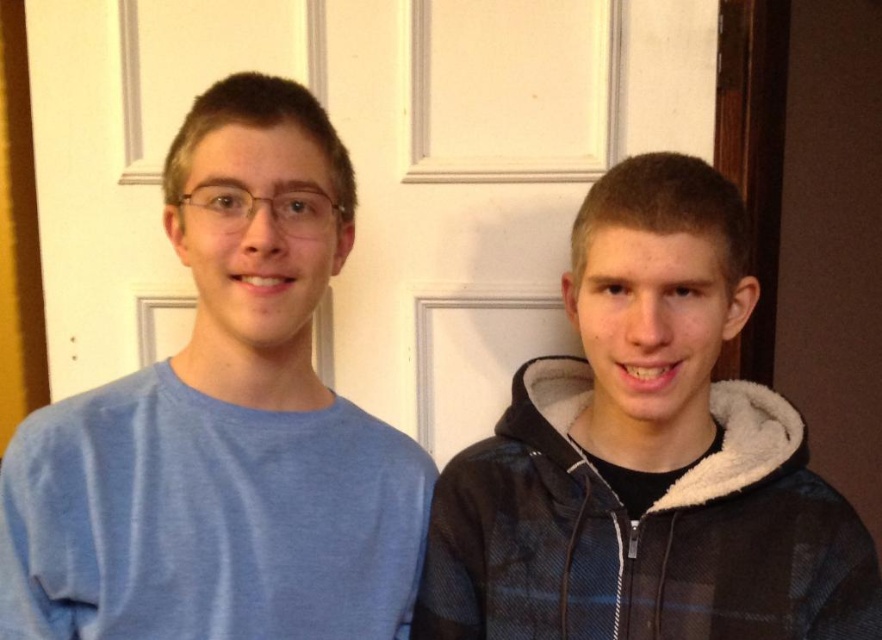
Between white matte door at center and matte blue shirt at left, which one has more height?

With more height is white matte door at center.

In the scene shown: Does white matte door at center have a larger size compared to matte blue shirt at left?

Correct, white matte door at center is larger in size than matte blue shirt at left.

Who is more forward, (x=419, y=284) or (x=262, y=92)?

Point (x=262, y=92)

The image size is (882, 640). Find the location of `white matte door at center`. white matte door at center is located at coordinates (363, 172).

Which is above, matte blue shirt at left or black fleece hoodie at center?

matte blue shirt at left is higher up.

Is point (280, 609) farther from viewer compared to point (771, 625)?

No, (280, 609) is in front of (771, 625).

The image size is (882, 640). I want to click on matte blue shirt at left, so click(x=223, y=426).

Can you confirm if white matte door at center is bigger than black fleece hoodie at center?

Indeed, white matte door at center has a larger size compared to black fleece hoodie at center.

Does white matte door at center have a smaller size compared to black fleece hoodie at center?

No.

Image resolution: width=882 pixels, height=640 pixels. In order to click on white matte door at center in this screenshot , I will do `click(363, 172)`.

Where is `white matte door at center`? This screenshot has width=882, height=640. white matte door at center is located at coordinates (363, 172).